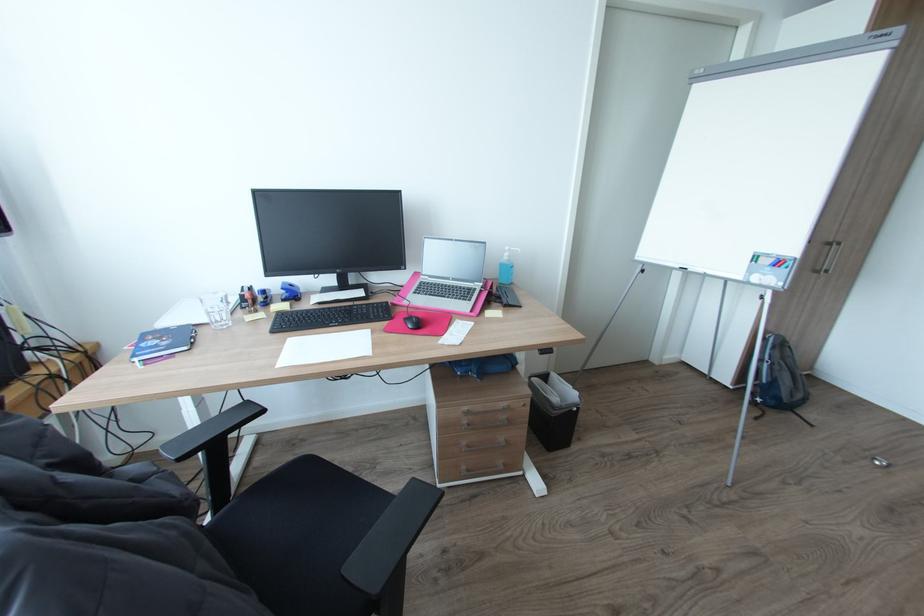
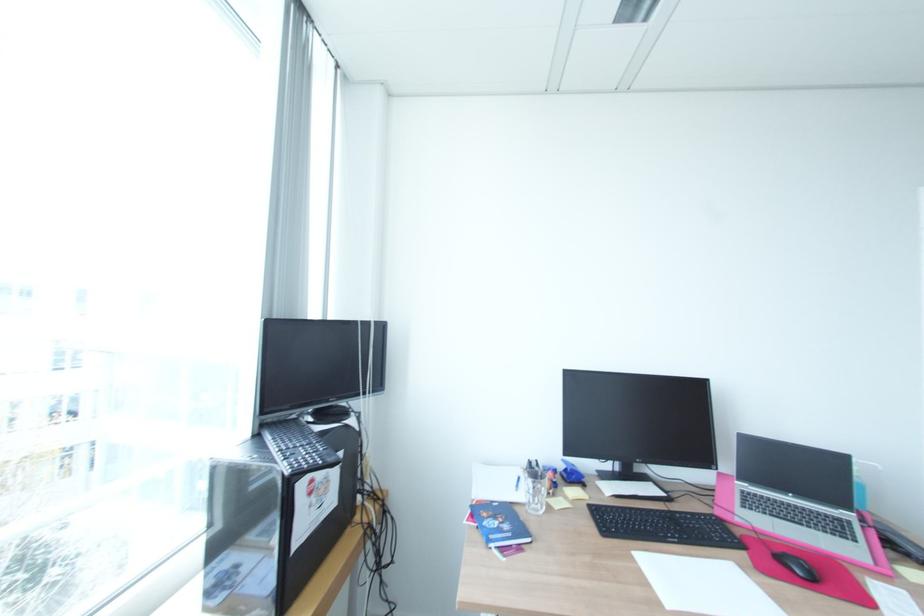
Find the pixel in the second image that matches (161,346) in the first image.

(504, 530)